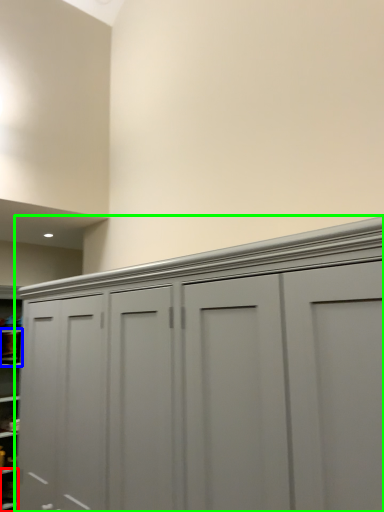
Question: Estimate the real-world distances between objects in this image. Which object is farther from cabinet (highlighted by a red box), cabinet (highlighted by a blue box) or cupboard (highlighted by a green box)?

Choices:
 (A) cabinet
 (B) cupboard

Answer: (B)